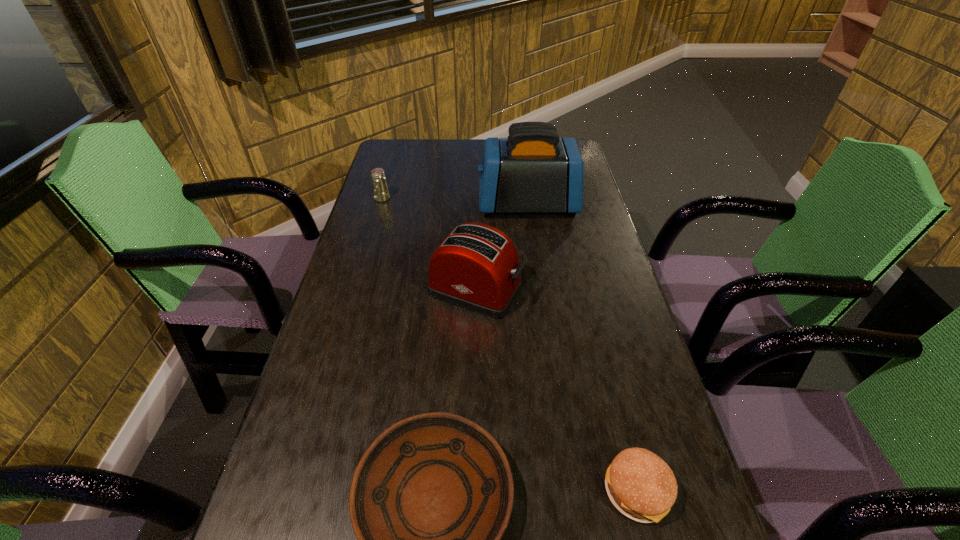
You are a GUI agent. You are given a task and a screenshot of the screen. Output one action in this format:
    pyautogui.click(x=<x>, y=<y>)
    Task: Click on the vacant region located 0.340m on the back of the fourth shortest object
    
    Given the screenshot: What is the action you would take?
    pyautogui.click(x=476, y=197)

In order to click on blank area located on the right of the leftmost object in this screenshot , I will do `click(453, 198)`.

Locate an element on the screen. Image resolution: width=960 pixels, height=540 pixels. blank space located 0.090m on the left of the hamburger is located at coordinates (553, 491).

In order to click on object present at the left edge in this screenshot , I will do `click(381, 193)`.

This screenshot has height=540, width=960. In order to click on toaster located in the right edge section of the desktop in this screenshot , I will do `click(533, 170)`.

Where is `hamburger that is at the right edge`? Image resolution: width=960 pixels, height=540 pixels. hamburger that is at the right edge is located at coordinates (640, 484).

Locate an element on the screen. This screenshot has height=540, width=960. free space at the left edge of the desktop is located at coordinates (396, 242).

Locate an element on the screen. This screenshot has height=540, width=960. free spot at the right edge of the desktop is located at coordinates (600, 285).

This screenshot has width=960, height=540. I want to click on vacant point located between the hamburger and the saltshaker, so click(x=510, y=345).

You are a GUI agent. You are given a task and a screenshot of the screen. Output one action in this format:
    pyautogui.click(x=<x>, y=<y>)
    Task: Click on the free space between the third tallest object and the hamburger
    
    Given the screenshot: What is the action you would take?
    pos(510,345)